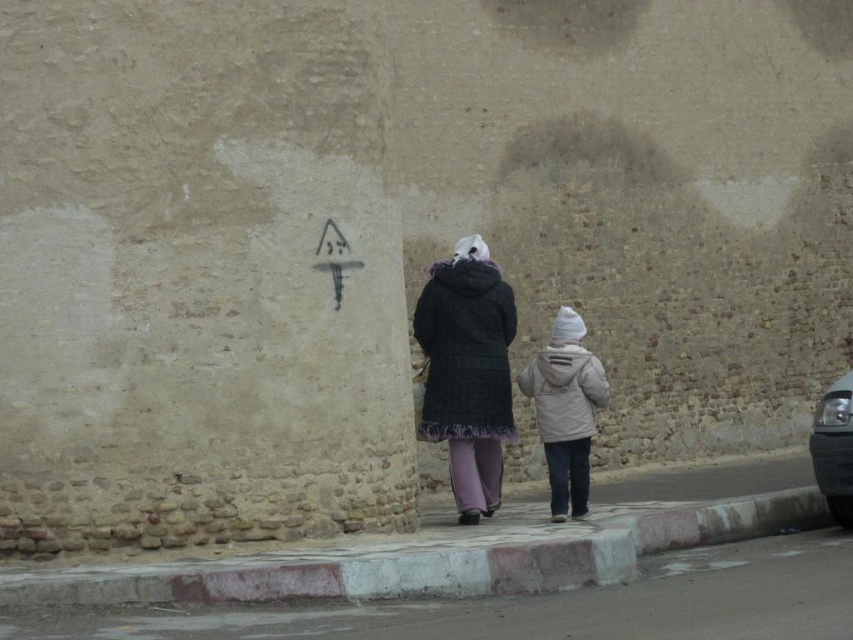
Question: Among these points, which one is nearest to the camera?

Choices:
 (A) (463, 611)
 (B) (476, 326)
 (C) (547, 380)

Answer: (A)

Question: Is plaid wool coat at center positioned at the back of light beige fabric jacket at lower center?

Choices:
 (A) yes
 (B) no

Answer: (B)

Question: Is plaid wool coat at center wider than light beige fabric jacket at lower center?

Choices:
 (A) yes
 (B) no

Answer: (A)

Question: Among these objects, which one is nearest to the camera?

Choices:
 (A) smooth concrete pavement at lower center
 (B) plaid wool coat at center
 (C) light beige fabric jacket at lower center

Answer: (A)

Question: Can you confirm if smooth concrete pavement at lower center is wider than plaid wool coat at center?

Choices:
 (A) no
 (B) yes

Answer: (B)

Question: Estimate the real-world distances between objects in this image. Which object is closer to the smooth concrete pavement at lower center?

Choices:
 (A) light beige fabric jacket at lower center
 (B) plaid wool coat at center

Answer: (A)